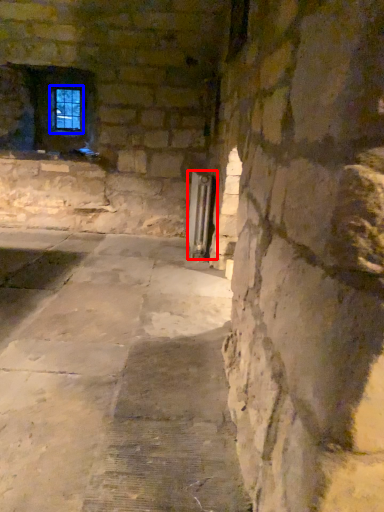
Question: Which object is closer to the camera taking this photo, elevator (highlighted by a red box) or window frame (highlighted by a blue box)?

Choices:
 (A) elevator
 (B) window frame

Answer: (A)